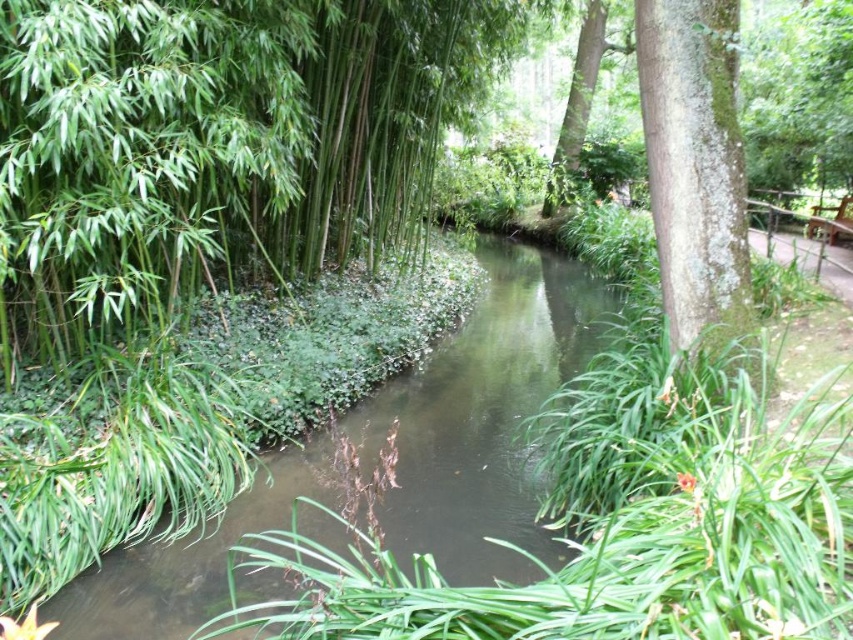
Question: Can you confirm if green bamboo at left is bigger than green leafy tree at upper center?

Choices:
 (A) yes
 (B) no

Answer: (B)

Question: Based on their relative distances, which object is farther from the green mossy bark tree at right?

Choices:
 (A) green bamboo at left
 (B) green leafy stream at center
 (C) green leafy tree at upper center

Answer: (C)

Question: Can you confirm if green mossy bark tree at right is wider than green leafy tree at upper center?

Choices:
 (A) no
 (B) yes

Answer: (A)

Question: Estimate the real-world distances between objects in this image. Which object is closer to the green leafy tree at upper center?

Choices:
 (A) green leafy stream at center
 (B) green bamboo at left

Answer: (A)

Question: Is green bamboo at left wider than green leafy stream at center?

Choices:
 (A) yes
 (B) no

Answer: (B)

Question: Which point appears farthest from the camera in this image?

Choices:
 (A) (598, 28)
 (B) (413, 6)

Answer: (A)